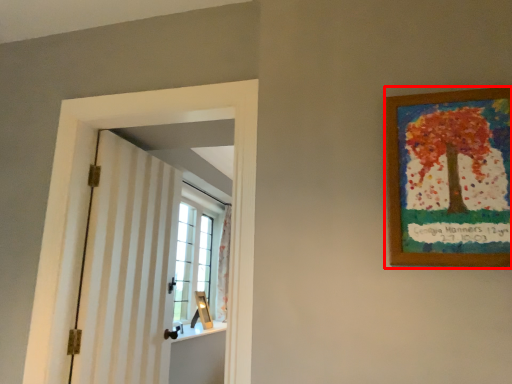
Question: Observing the image, what is the correct spatial positioning of picture frame (annotated by the red box) in reference to barn door?

Choices:
 (A) left
 (B) right

Answer: (B)